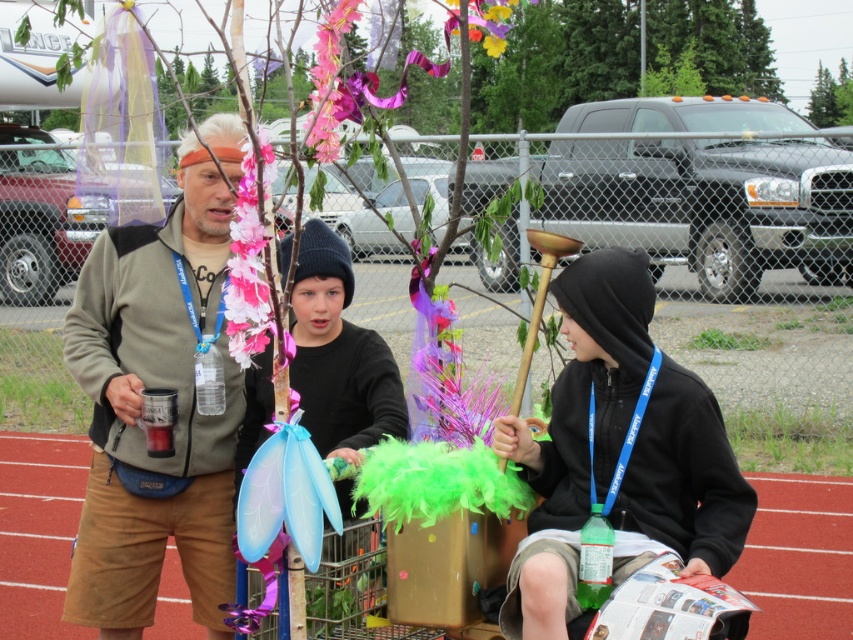
What do you see at coordinates (618, 452) in the screenshot? This screenshot has width=853, height=640. I see `black fleece hoodie at center` at bounding box center [618, 452].

Between point (643, 444) and point (316, 291), which one is positioned in front?

Point (643, 444)

Where is `black fleece hoodie at center`? The image size is (853, 640). black fleece hoodie at center is located at coordinates (618, 452).

Based on the photo, who is shorter, matte gray hoodie at center or black matte jacket at center?

black matte jacket at center

Is point (225, 445) closer to camera compared to point (318, 237)?

No, it is behind (318, 237).

Locate an element on the screen. The height and width of the screenshot is (640, 853). matte gray hoodie at center is located at coordinates (146, 397).

How far apart are matte gray hoodie at center and black fleece hoodie at center?

The distance of matte gray hoodie at center from black fleece hoodie at center is 1.30 meters.

Does matte gray hoodie at center have a greater height compared to black fleece hoodie at center?

Yes, matte gray hoodie at center is taller than black fleece hoodie at center.

Does point (216, 243) lie behind point (595, 483)?

Yes.

Find the location of `matte gray hoodie at center`. matte gray hoodie at center is located at coordinates (146, 397).